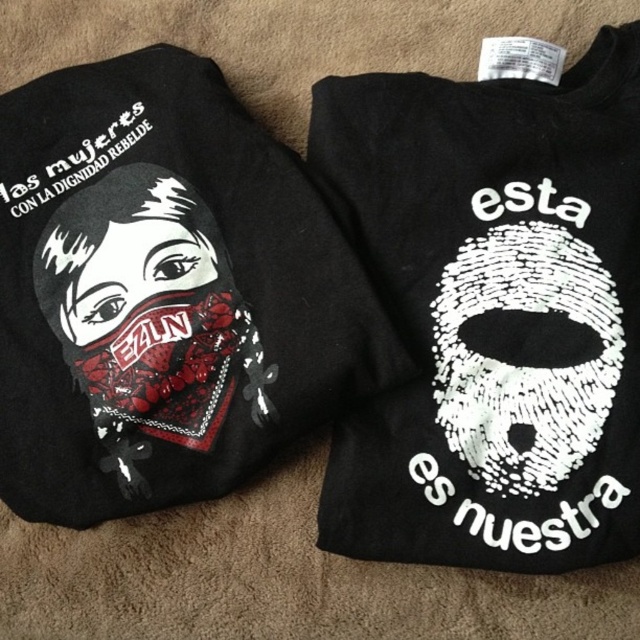
Question: Can you confirm if black matte t-shirt at center is positioned to the left of matte black t-shirt at upper left?

Choices:
 (A) no
 (B) yes

Answer: (A)

Question: Which point is farther to the camera?

Choices:
 (A) (177, 344)
 (B) (410, 99)

Answer: (A)

Question: Can you confirm if black matte t-shirt at center is positioned above matte black t-shirt at upper left?

Choices:
 (A) yes
 (B) no

Answer: (B)

Question: Among these objects, which one is farthest from the camera?

Choices:
 (A) matte black t-shirt at upper left
 (B) black matte t-shirt at center

Answer: (A)

Question: Does black matte t-shirt at center have a lesser width compared to matte black t-shirt at upper left?

Choices:
 (A) no
 (B) yes

Answer: (B)